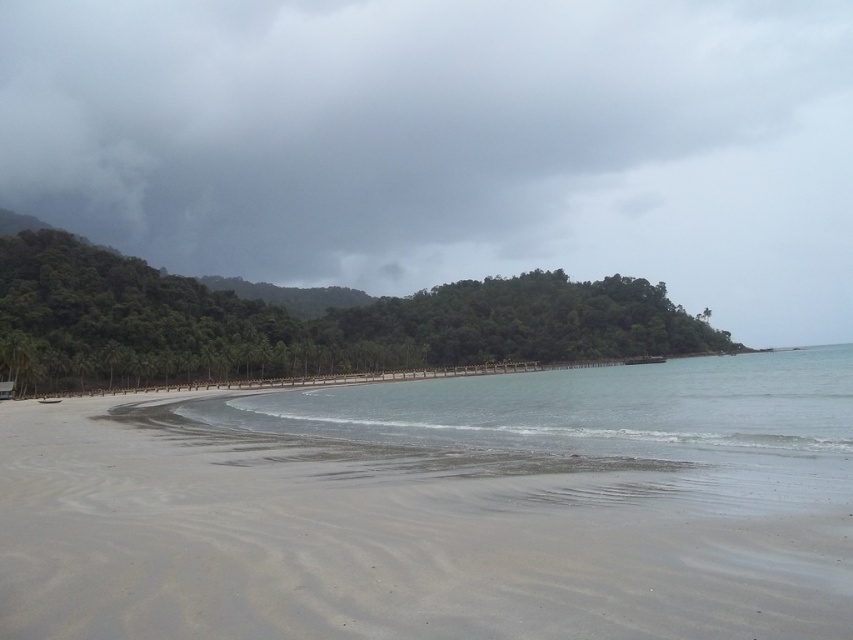
Does smooth sand at lower center have a greater width compared to green leafy island at center?

Incorrect, smooth sand at lower center's width does not surpass green leafy island at center's.

The width and height of the screenshot is (853, 640). I want to click on smooth sand at lower center, so click(x=384, y=544).

The height and width of the screenshot is (640, 853). What are the coordinates of `smooth sand at lower center` in the screenshot? It's located at [384, 544].

At what (x,y) coordinates should I click in order to perform the action: click on smooth sand at lower center. Please return your answer as a coordinate pair (x, y). This screenshot has height=640, width=853. Looking at the image, I should click on (384, 544).

Does gray cloudy sky at upper center appear over green leafy island at center?

Indeed, gray cloudy sky at upper center is positioned over green leafy island at center.

Can you confirm if gray cloudy sky at upper center is shorter than green leafy island at center?

No.

You are a GUI agent. You are given a task and a screenshot of the screen. Output one action in this format:
    pyautogui.click(x=<x>, y=<y>)
    Task: Click on the gray cloudy sky at upper center
    
    Given the screenshot: What is the action you would take?
    pyautogui.click(x=440, y=138)

Is point (689, 93) closer to viewer compared to point (645, 484)?

That is False.

The width and height of the screenshot is (853, 640). Describe the element at coordinates (440, 138) in the screenshot. I see `gray cloudy sky at upper center` at that location.

Where is `gray cloudy sky at upper center`? This screenshot has height=640, width=853. gray cloudy sky at upper center is located at coordinates (440, 138).